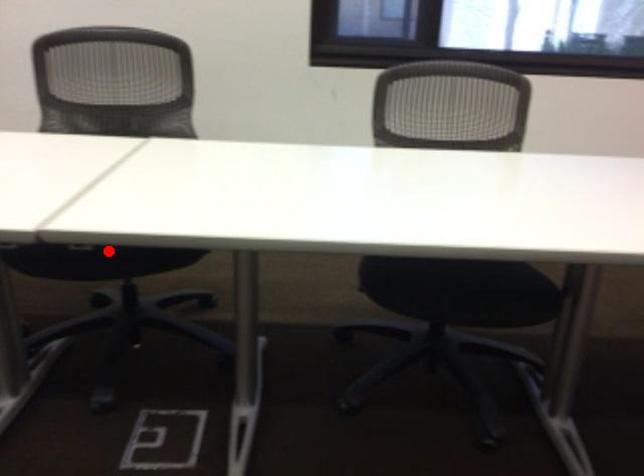
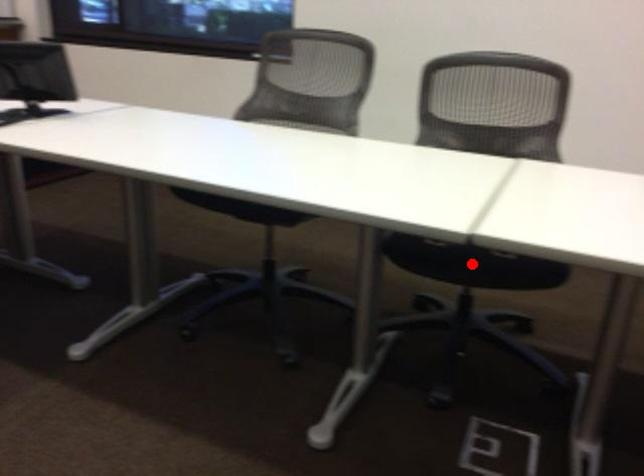
I am providing you with two images of the same scene from different viewpoints. A red point is marked on the first image and another point is marked on the second image. Does the point marked in image1 correspond to the same location as the one in image2?

Yes